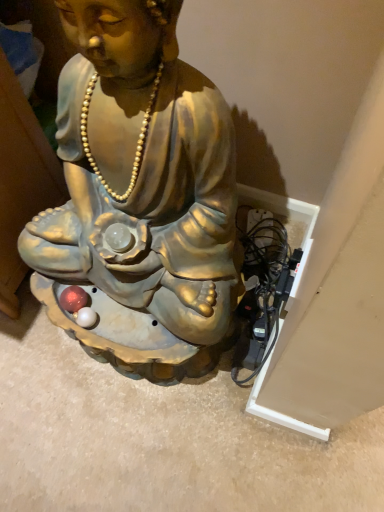
In order to face gold glossy statue at center, should I rotate leftwards or rightwards?

To align with it, rotate left about 9.969°.

What do you see at coordinates (142, 173) in the screenshot? I see `gold glossy statue at center` at bounding box center [142, 173].

The image size is (384, 512). I want to click on gold glossy statue at center, so click(142, 173).

The width and height of the screenshot is (384, 512). Identify the location of gold glossy statue at center. (142, 173).